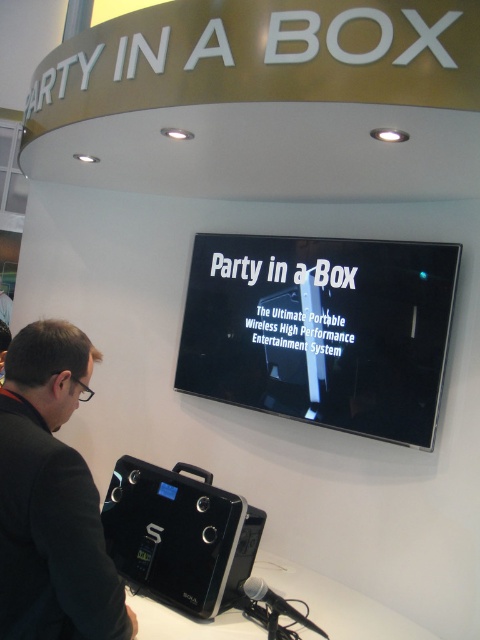
Who is higher up, black glossy sign at center or black fabric jacket at lower left?

black glossy sign at center is above.

Can you confirm if black glossy sign at center is positioned below black fabric jacket at lower left?

No, black glossy sign at center is not below black fabric jacket at lower left.

Is point (388, 426) closer to viewer compared to point (32, 461)?

No.

Identify the location of black glossy sign at center. This screenshot has height=640, width=480. (321, 330).

Does black glossy sign at center appear on the left side of black plastic speaker at lower center?

In fact, black glossy sign at center is to the right of black plastic speaker at lower center.

From the picture: Is the position of black glossy sign at center less distant than that of black plastic speaker at lower center?

No, black glossy sign at center is further to the viewer.

Measure the distance between point (399, 305) and camera.

Point (399, 305) and camera are 2.42 meters apart from each other.

Where is `black glossy sign at center`? The width and height of the screenshot is (480, 640). black glossy sign at center is located at coordinates (321, 330).

The image size is (480, 640). In order to click on black fabric jacket at lower left in this screenshot , I will do `click(51, 490)`.

Between black fabric jacket at lower left and black plastic speaker at lower center, which one has more height?

black fabric jacket at lower left

Which is behind, point (55, 502) or point (227, 508)?

Positioned behind is point (227, 508).

At what (x,y) coordinates should I click in order to perform the action: click on black fabric jacket at lower left. Please return your answer as a coordinate pair (x, y). Looking at the image, I should click on (51, 490).